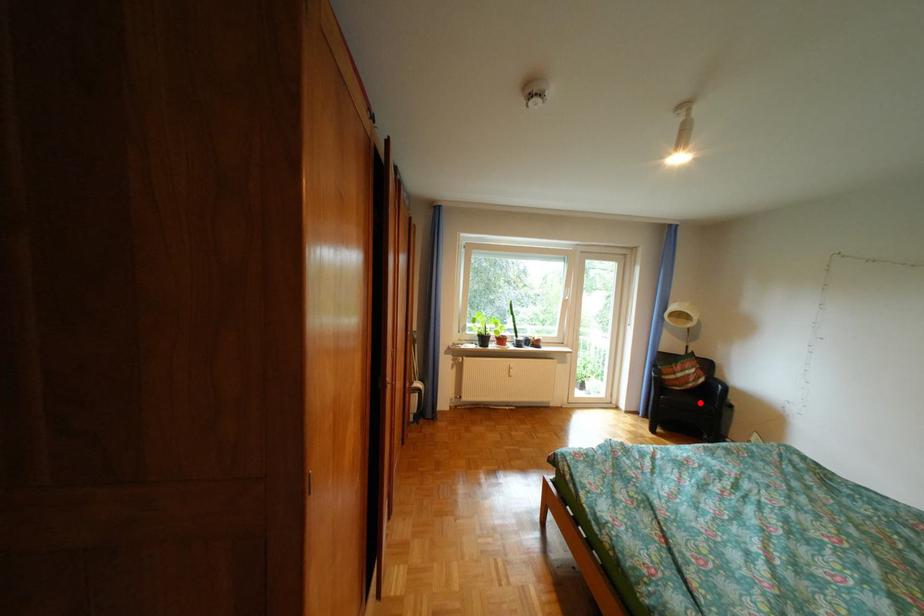
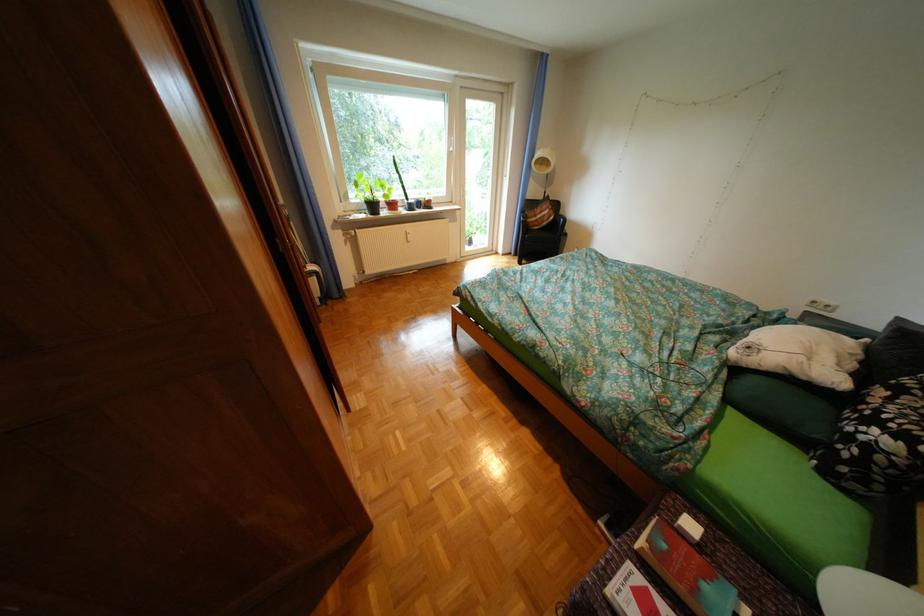
The point at the highlighted location is marked in the first image. Where is the corresponding point in the second image?

(555, 238)